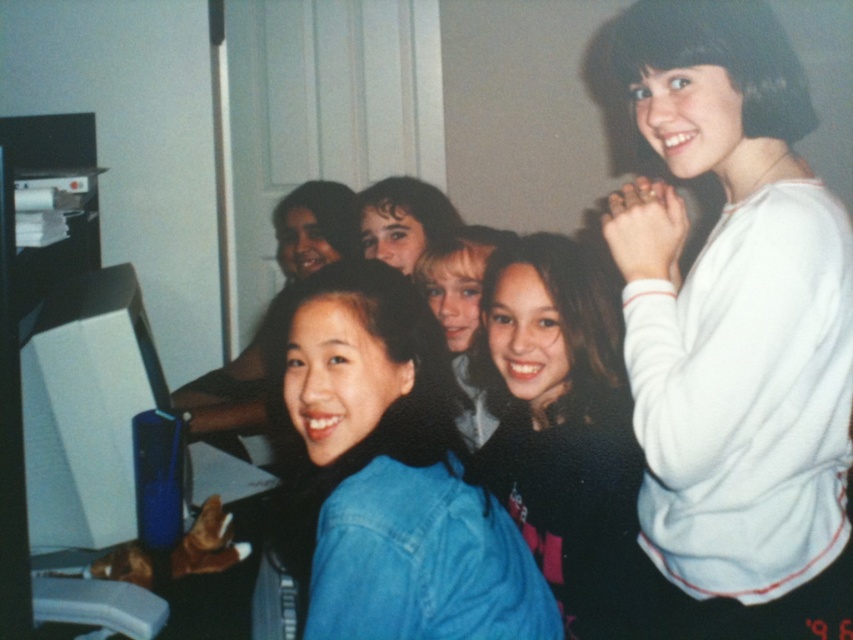
Which is behind, point (773, 476) or point (399, 209)?

Point (399, 209)

Can you confirm if white fleece sweater at upper right is thinner than dark brown hair at center?

In fact, white fleece sweater at upper right might be wider than dark brown hair at center.

Locate an element on the screen. This screenshot has width=853, height=640. white fleece sweater at upper right is located at coordinates (735, 326).

In the scene shown: Does black matte shirt at center have a greater height compared to dark brown hair at center?

Correct, black matte shirt at center is much taller as dark brown hair at center.

Is black matte shirt at center below dark brown hair at center?

Correct, black matte shirt at center is located below dark brown hair at center.

What do you see at coordinates (560, 426) in the screenshot? The width and height of the screenshot is (853, 640). I see `black matte shirt at center` at bounding box center [560, 426].

The image size is (853, 640). What are the coordinates of `black matte shirt at center` in the screenshot? It's located at (560, 426).

Is white fleece sweater at upper right to the left of black matte shirt at center from the viewer's perspective?

No, white fleece sweater at upper right is not to the left of black matte shirt at center.

Can you confirm if white fleece sweater at upper right is smaller than black matte shirt at center?

Incorrect, white fleece sweater at upper right is not smaller in size than black matte shirt at center.

Is point (647, 125) more distant than point (556, 493)?

No, (647, 125) is closer to viewer.

At what (x,y) coordinates should I click in order to perform the action: click on white fleece sweater at upper right. Please return your answer as a coordinate pair (x, y). The height and width of the screenshot is (640, 853). Looking at the image, I should click on (735, 326).